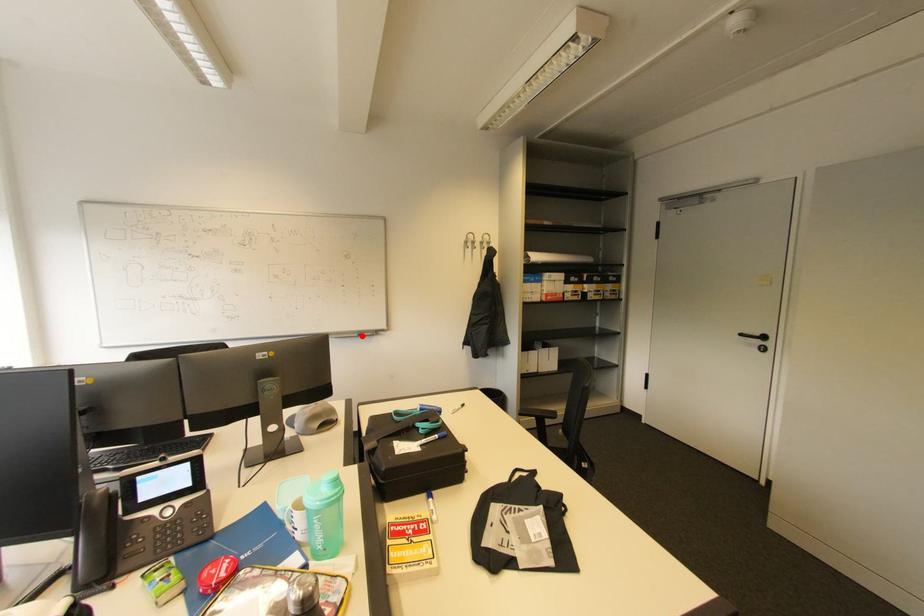
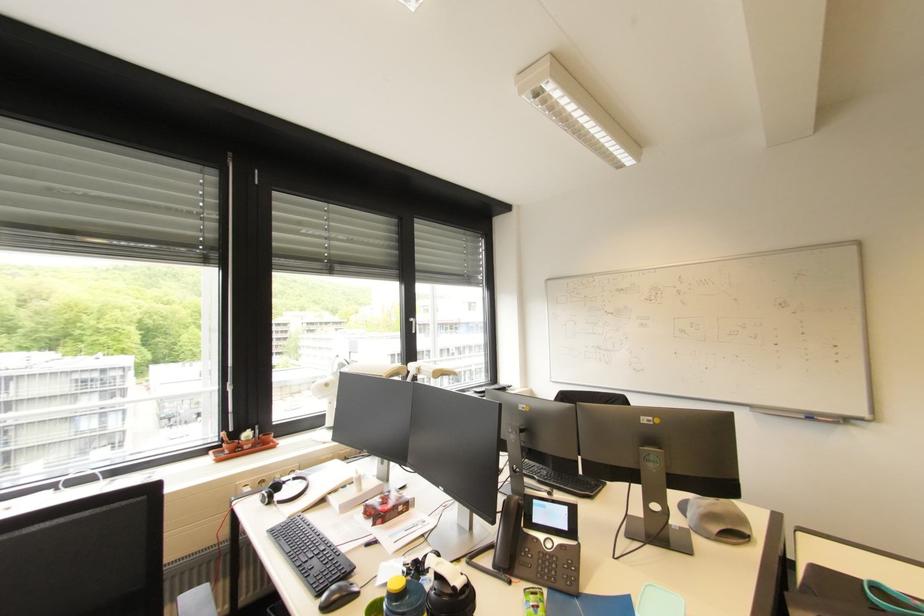
Locate, in the second image, the point that corresponds to the highlighted location in the first image.

(808, 418)